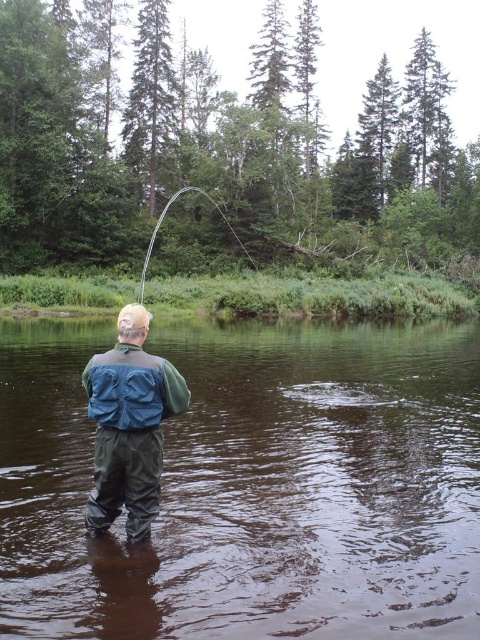
You are a photographer trying to capture the fisherman and the rod in a single shot. Given that the green waterproof suit at center is shorter than the shiny silver rod at center, will you need to adjust your camera angle to include both?

The green waterproof suit at center has a lesser height compared to the shiny silver rod at center, so you will need to lower your camera angle to ensure both are fully visible in the shot.

Looking at this image, you are a photographer trying to capture the fisherman and the fish in a single shot. Based on the scene, can you tell if the green waterproof suit at center is positioned higher or lower than the shiny silver rod at center?

The green waterproof suit at center is below the shiny silver rod at center, so it is positioned lower than the shiny silver rod at center.

You are a photographer trying to capture the fisherman and the rod in the scene. Since the blue waterproof jacket at back is smaller than the shiny silver rod at center, which object should you focus on to ensure both are in frame without zooming in or out?

The blue waterproof jacket at back is smaller than the shiny silver rod at center, so you should focus on the shiny silver rod at center to ensure both are in frame without needing to adjust the zoom.